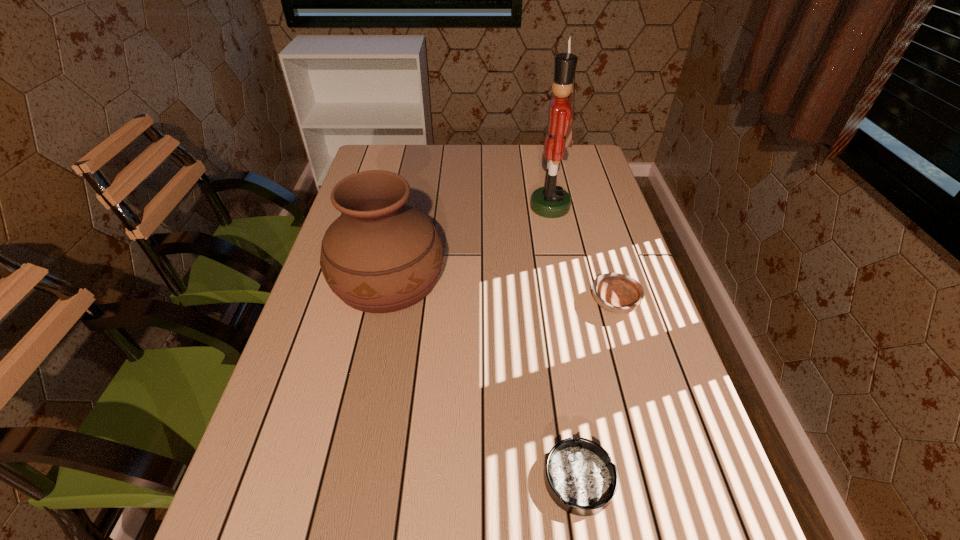
Where is `the farthest object`? This screenshot has width=960, height=540. the farthest object is located at coordinates (551, 201).

Locate an element on the screen. This screenshot has width=960, height=540. nutcracker is located at coordinates (551, 201).

Where is `the third shortest object`? the third shortest object is located at coordinates (380, 255).

The width and height of the screenshot is (960, 540). What are the coordinates of `the leftmost object` in the screenshot? It's located at (380, 255).

Locate an element on the screen. the third tallest object is located at coordinates (617, 293).

At what (x,y) coordinates should I click in order to perform the action: click on the shortest object. Please return your answer as a coordinate pair (x, y). Looking at the image, I should click on (581, 479).

Image resolution: width=960 pixels, height=540 pixels. I want to click on the nearest object, so click(x=581, y=479).

Locate an element on the screen. free spot located 0.210m on the front-facing side of the nutcracker is located at coordinates (462, 207).

Locate an element on the screen. Image resolution: width=960 pixels, height=540 pixels. vacant space located 0.350m on the front-facing side of the nutcracker is located at coordinates (417, 207).

At what (x,y) coordinates should I click in order to perform the action: click on free location located on the front-facing side of the nutcracker. Please return your answer as a coordinate pair (x, y). The image size is (960, 540). Looking at the image, I should click on (439, 207).